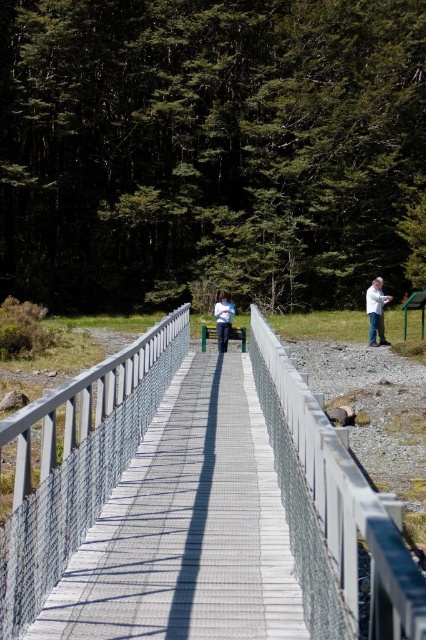
You are a photographer standing on the metal mesh bridge at center and want to take a photo of the white matte shirt at right. Considering the size difference between the two objects, how might you adjust your camera angle to ensure both are clearly visible in the frame?

Since the metal mesh bridge at center is larger in size than the white matte shirt at right, you can zoom out slightly to capture the entire bridge while still including the white matte shirt at right in the frame.

You are standing on the metal mesh bridge at center and looking upwards. You notice a light blue fabric jacket at center above you. Based on the scene description, could the jacket be hanging from the bridge railing?

Yes, the metal mesh bridge at center is positioned under the light blue fabric jacket at center, which suggests that the jacket is hanging from the bridge railing above.

You are standing on the metal mesh bridge at center and see the light blue fabric jacket at center ahead. Which direction should you walk to reach the jacket?

You should walk to the right because the metal mesh bridge at center is to the left of the light blue fabric jacket at center, so moving towards the right will bring you closer to the jacket.